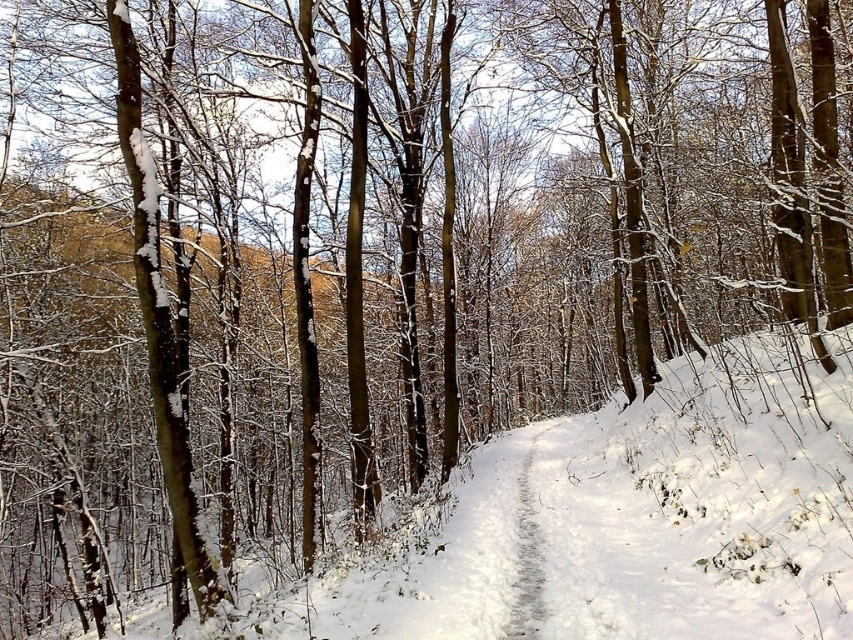
You are planning to build a snowman using the white fluffy snow at center. However, there is a gray textured trail at center in the way. Can you move the snow from the white fluffy snow area to the side of the trail to build your snowman?

The white fluffy snow at center might be wider than gray textured trail at center, so there could be enough space on either side of the trail to gather snow for building the snowman without needing to move it far.

You are a hiker carrying a backpack and need to cross the forest. You see the white fluffy snow at center and the gray textured trail at center. Which one is closer to you?

The white fluffy snow at center and gray textured trail at center are 1.78 meters apart, but the question does not specify which is closer. The answer cannot be determined with the given information.